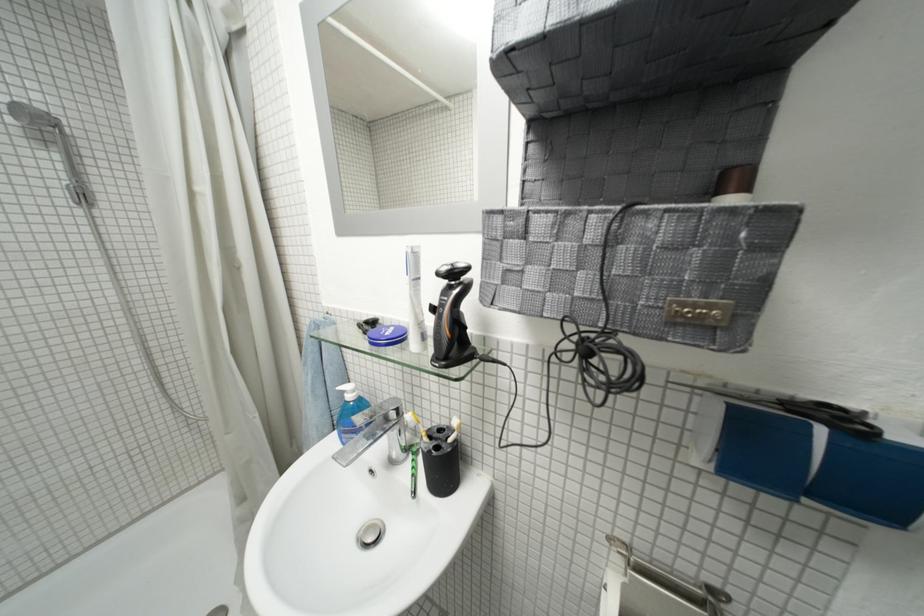
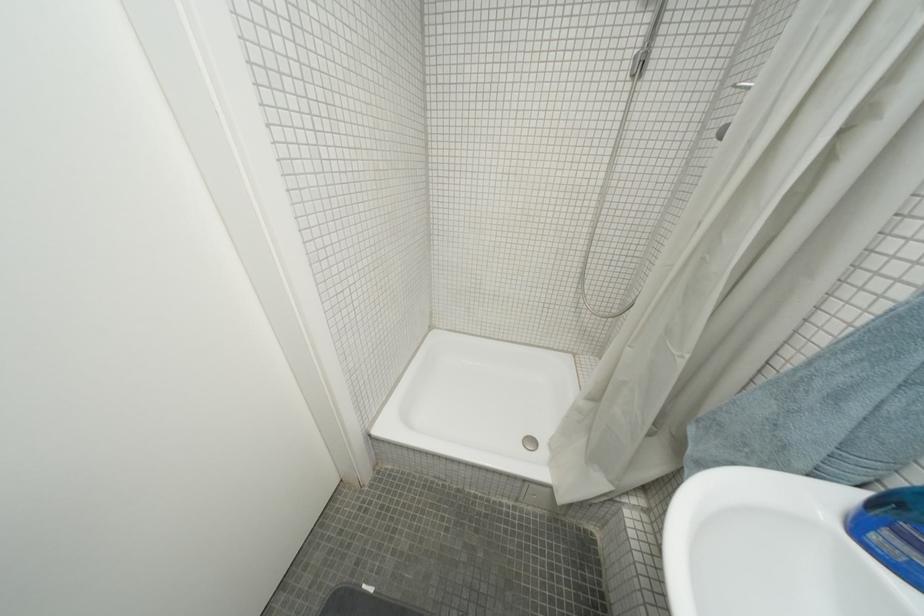
Locate, in the second image, the point that corresponds to [266,416] in the first image.

(697, 359)